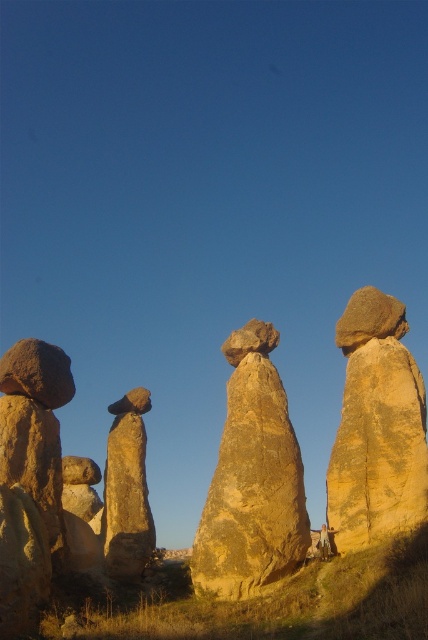
Question: Can you confirm if yellow sandstone rock at center is smaller than yellowish sandstone rock at right?

Choices:
 (A) yes
 (B) no

Answer: (A)

Question: Is yellow sandstone rock at center wider than yellowish sandstone rock at right?

Choices:
 (A) yes
 (B) no

Answer: (B)

Question: Which of the following is the farthest from the observer?

Choices:
 (A) (112, 528)
 (B) (228, 422)
 (C) (407, 403)

Answer: (A)

Question: Which object appears farthest from the camera in this image?

Choices:
 (A) yellowish sandstone rock at right
 (B) smooth sandstone rock at center
 (C) yellow sandstone rock at center

Answer: (B)

Question: Which point is closer to the camera taking this photo?

Choices:
 (A) (395, 488)
 (B) (219, 525)

Answer: (B)

Question: Does yellowish sandstone rock formation at center have a larger size compared to smooth sandstone rock at center?

Choices:
 (A) no
 (B) yes

Answer: (B)